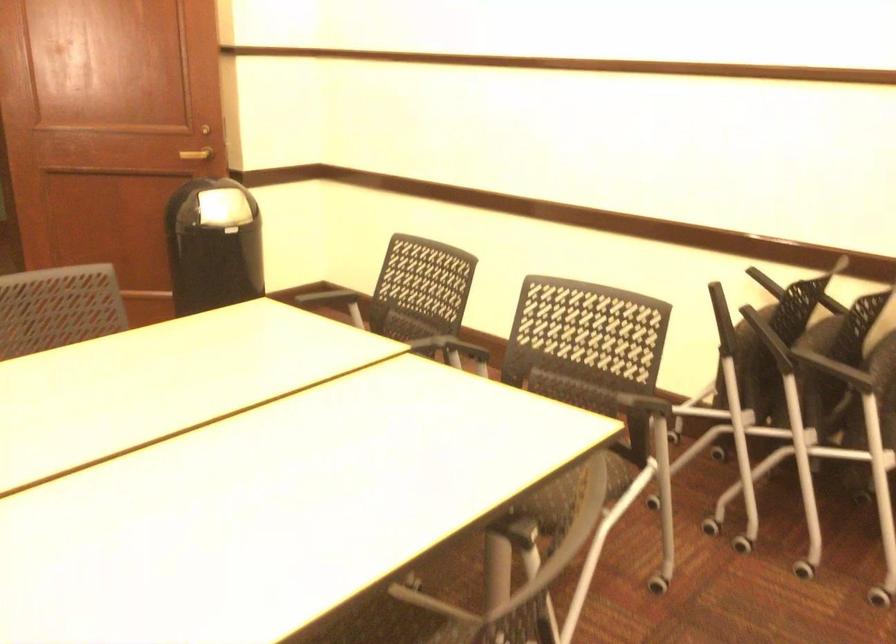
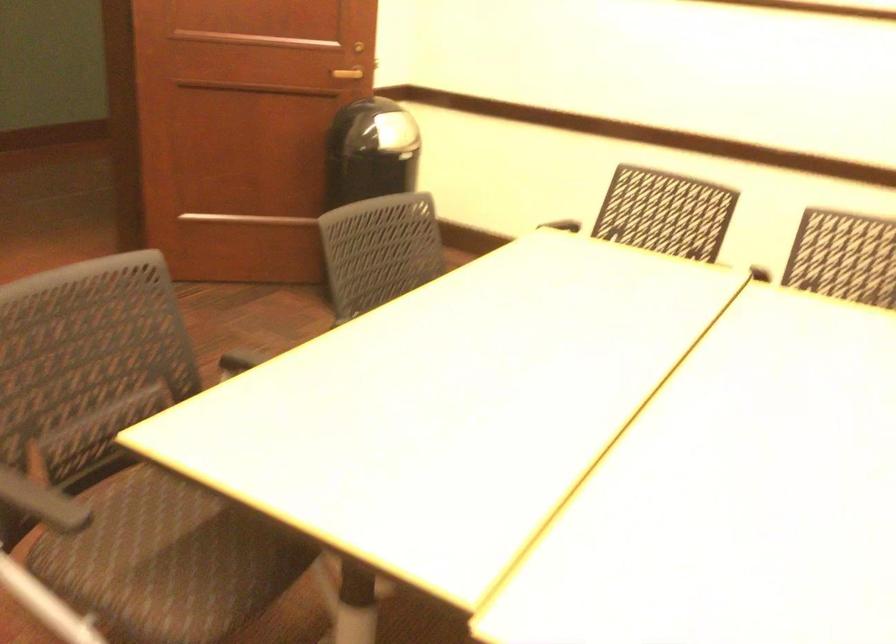
Question: What movement of the cameraman would produce the second image?

Choices:
 (A) Left
 (B) Right
 (C) Forward
 (D) Backward

Answer: (A)